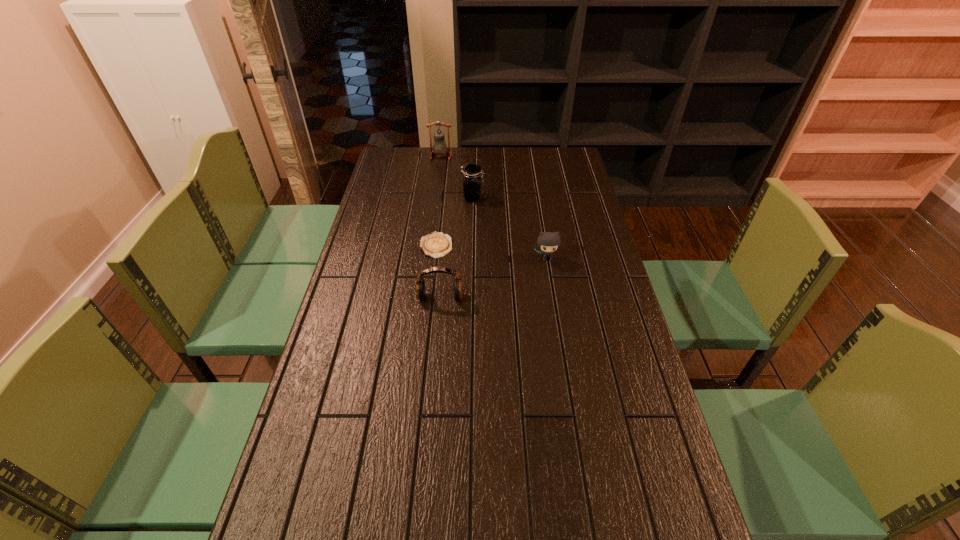
At what (x,y) coordinates should I click in order to perform the action: click on the farthest object. Please return your answer as a coordinate pair (x, y). Looking at the image, I should click on (439, 140).

Locate an element on the screen. Image resolution: width=960 pixels, height=540 pixels. bell is located at coordinates (439, 140).

In order to click on jar in this screenshot , I will do [x=472, y=177].

Find the location of a particular element. The height and width of the screenshot is (540, 960). the nearest object is located at coordinates (420, 283).

Locate an element on the screen. kitten is located at coordinates (548, 242).

The image size is (960, 540). I want to click on the shortest object, so click(x=436, y=245).

This screenshot has height=540, width=960. Identify the location of vacant area situated on the front of the farthest object. (438, 179).

Locate an element on the screen. The width and height of the screenshot is (960, 540). vacant space situated on the lid of the fourth nearest object is located at coordinates [x=535, y=198].

I want to click on vacant space located on the ear cups of the headset, so click(x=433, y=382).

Where is `blank space located on the front-facing side of the kitten`? The width and height of the screenshot is (960, 540). blank space located on the front-facing side of the kitten is located at coordinates (558, 325).